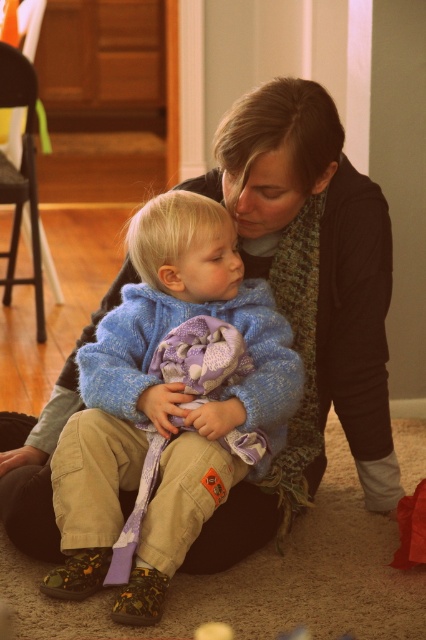
At what (x,y) coordinates should I click in order to perform the action: click on knitted scarf at center. Please return your answer as a coordinate pair (x, y). This screenshot has height=640, width=426. Looking at the image, I should click on (307, 300).

Who is positioned more to the right, knitted scarf at center or blue knitted sweater at center?

From the viewer's perspective, knitted scarf at center appears more on the right side.

Image resolution: width=426 pixels, height=640 pixels. Find the location of `knitted scarf at center`. knitted scarf at center is located at coordinates (307, 300).

This screenshot has width=426, height=640. In order to click on knitted scarf at center in this screenshot , I will do `click(307, 300)`.